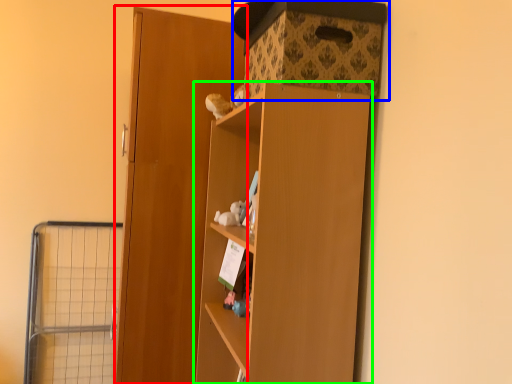
Question: Based on their relative distances, which object is farther from door (highlighted by a red box)? Choose from storage box (highlighted by a blue box) and cupboard (highlighted by a green box).

Choices:
 (A) storage box
 (B) cupboard

Answer: (B)